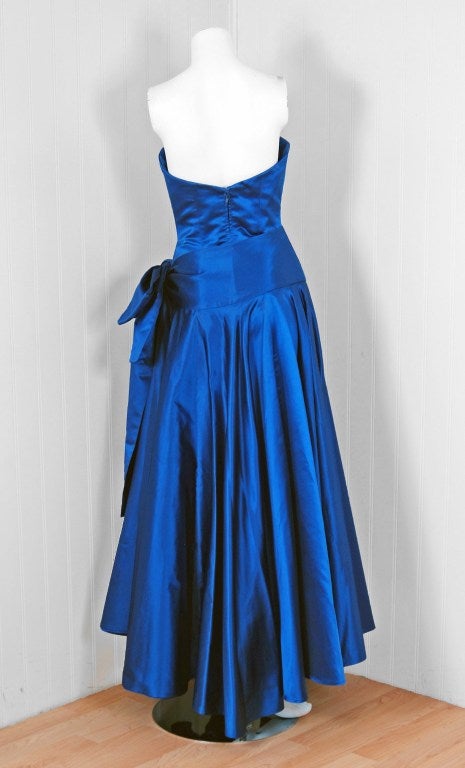
Find the location of a particular element. mannequin is located at coordinates (247, 121).